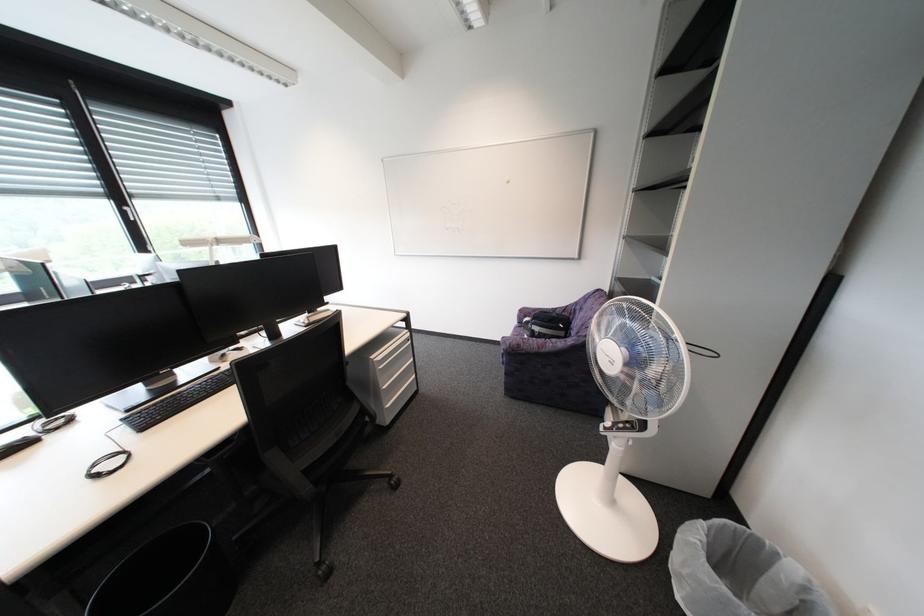
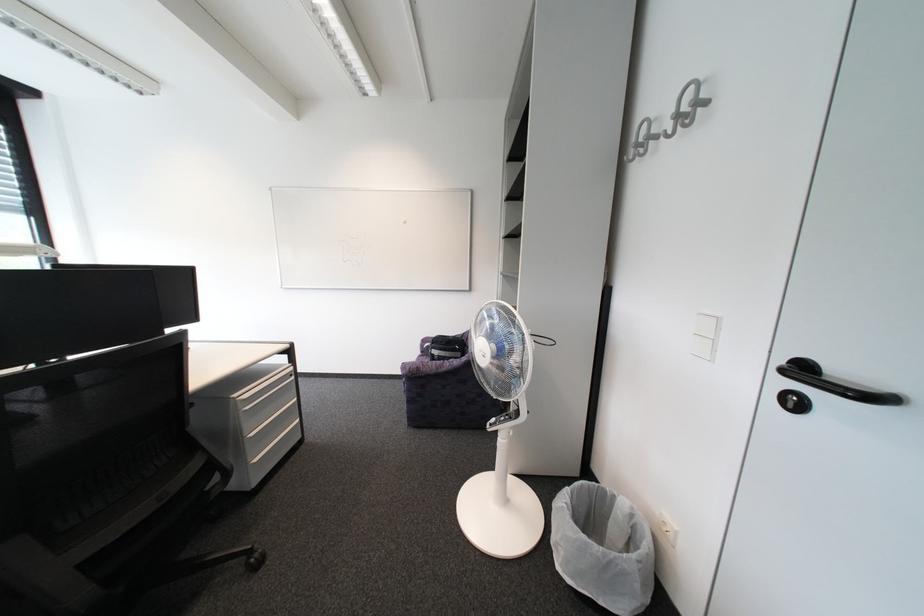
The images are taken continuously from a first-person perspective. In which direction are you moving?

The cameraman walked toward right, backward.